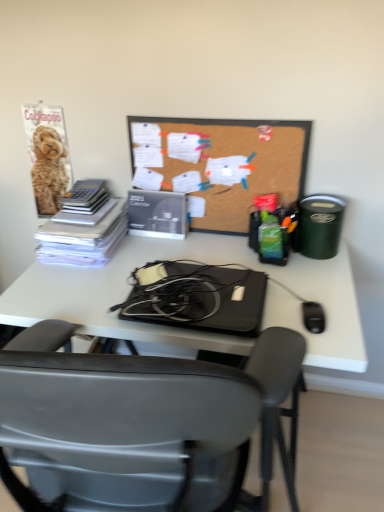
The height and width of the screenshot is (512, 384). I want to click on vacant space behind black plastic mouse at lower right, so click(x=307, y=284).